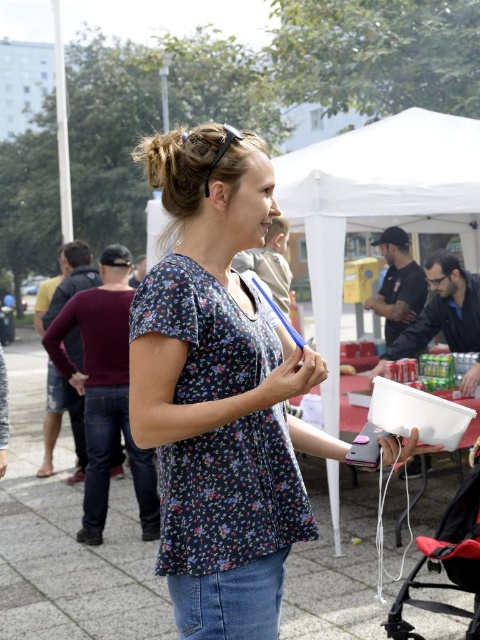
Question: Is floral fabric blouse at center to the left of white fabric tent at upper center from the viewer's perspective?

Choices:
 (A) yes
 (B) no

Answer: (A)

Question: Which object is farther from the camera taking this photo?

Choices:
 (A) white fabric tent at upper center
 (B) red fabric baby carriage at lower right
 (C) floral fabric blouse at center

Answer: (A)

Question: Among these points, which one is farthest from the camera?

Choices:
 (A) (288, 211)
 (B) (223, 625)

Answer: (A)

Question: Can you confirm if floral fabric blouse at center is positioned to the right of red fabric baby carriage at lower right?

Choices:
 (A) yes
 (B) no

Answer: (B)

Question: Can you confirm if floral fabric blouse at center is smaller than red fabric baby carriage at lower right?

Choices:
 (A) yes
 (B) no

Answer: (B)

Question: Which point is closer to the camera taking this photo?

Choices:
 (A) (465, 552)
 (B) (243, 221)

Answer: (B)